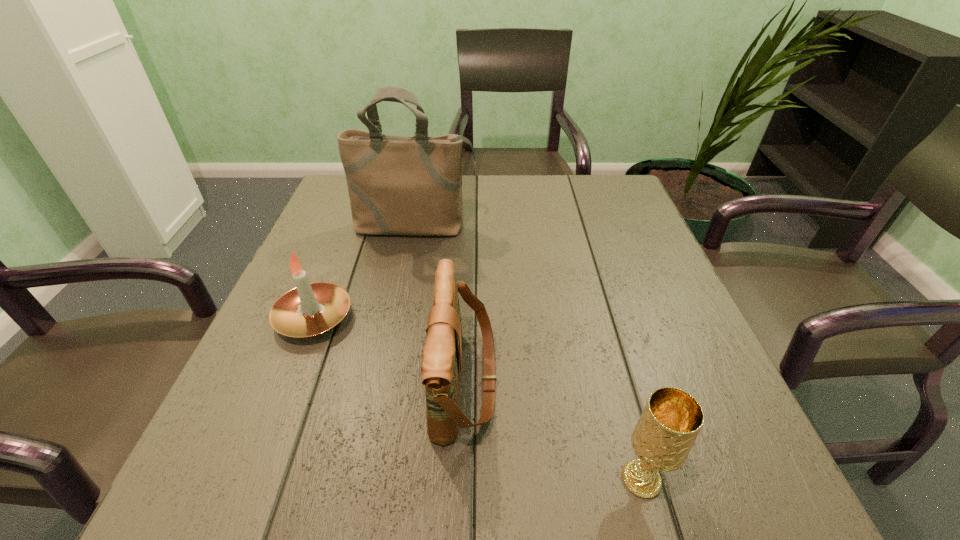
I want to click on the farthest object, so click(397, 185).

Identify the location of the taller shoulder bag. The width and height of the screenshot is (960, 540). (397, 185).

At what (x,y) coordinates should I click in order to perform the action: click on the nearer shoulder bag. Please return your answer as a coordinate pair (x, y). This screenshot has width=960, height=540. Looking at the image, I should click on (442, 355).

Locate an element on the screen. The width and height of the screenshot is (960, 540). chalice is located at coordinates (662, 439).

What are the coordinates of `the nearest object` in the screenshot? It's located at (662, 439).

Identify the location of candle. This screenshot has width=960, height=540. (311, 309).

Locate an element on the screen. This screenshot has height=540, width=960. vacant space located on the front-facing side of the farther shoulder bag is located at coordinates (407, 269).

I want to click on free location located 0.160m on the front-facing side of the nearer shoulder bag, so click(x=589, y=380).

I want to click on vacant space located on the right of the chalice, so click(x=730, y=480).

Where is `free space located 0.170m on the front of the candle`? The width and height of the screenshot is (960, 540). free space located 0.170m on the front of the candle is located at coordinates pyautogui.click(x=269, y=433).